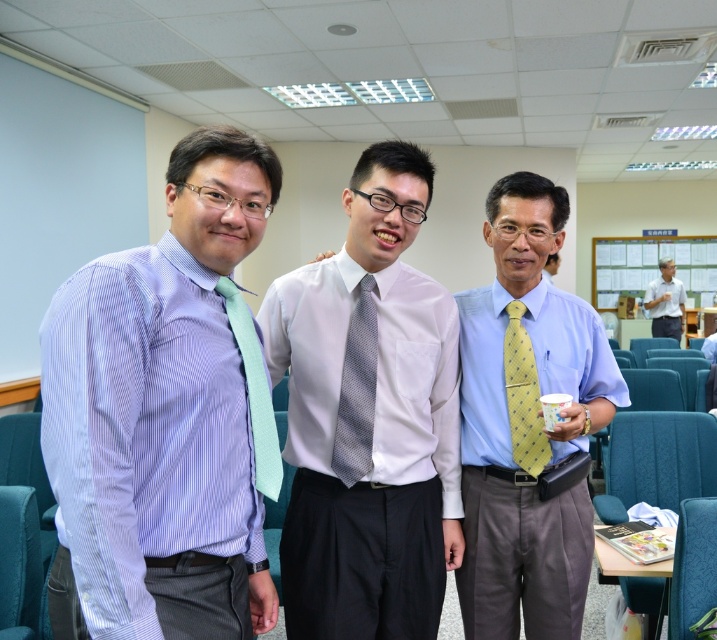
Does yellow dotted tie at center lie behind yellow dotted tie at right?

That is False.

The height and width of the screenshot is (640, 717). Find the location of `yellow dotted tie at center`. yellow dotted tie at center is located at coordinates pyautogui.click(x=526, y=422).

Measure the distance between matte blue shirt at left and yellow textured tie at center.

They are 14.37 feet apart.

Which is behind, point (141, 349) or point (543, 272)?

Positioned behind is point (543, 272).

Where is `matte blue shirt at left`? The width and height of the screenshot is (717, 640). matte blue shirt at left is located at coordinates (166, 417).

Locate an element on the screen. The height and width of the screenshot is (640, 717). white textured shirt at center is located at coordinates (369, 419).